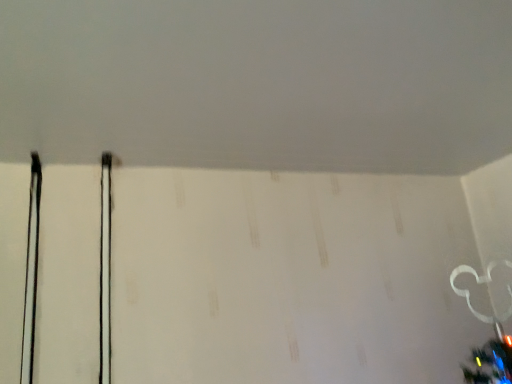
Question: Should I look upward or downward to see white matte wall at upper center?

Choices:
 (A) up
 (B) down

Answer: (A)